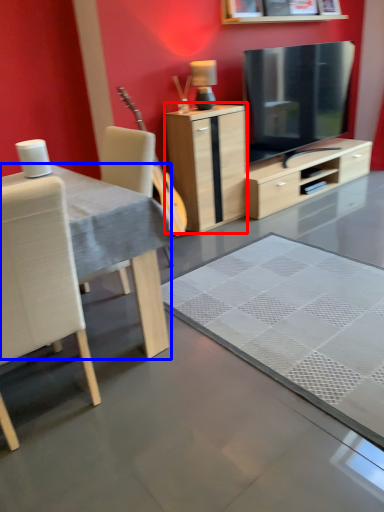
Question: Which point is further to the camera, cabinetry (highlighted by a red box) or desk (highlighted by a blue box)?

Choices:
 (A) cabinetry
 (B) desk

Answer: (A)